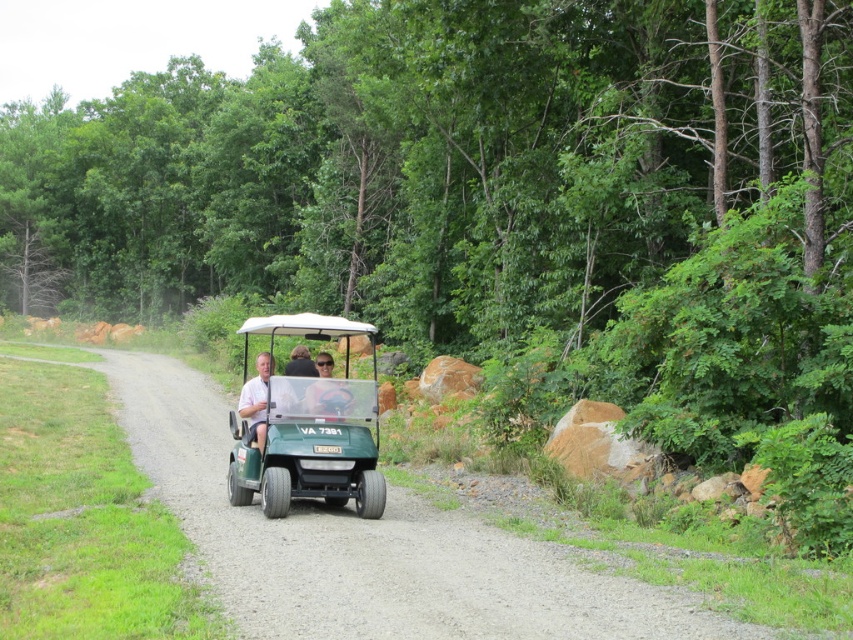
Question: Is green matte golf cart at center smaller than white matte golf cart at center?

Choices:
 (A) yes
 (B) no

Answer: (B)

Question: Can you confirm if green matte golf cart at center is wider than white matte golf cart at center?

Choices:
 (A) no
 (B) yes

Answer: (B)

Question: Which object appears farthest from the camera in this image?

Choices:
 (A) white matte golf cart at center
 (B) green matte golf cart at center

Answer: (A)

Question: Does green matte golf cart at center come in front of white matte golf cart at center?

Choices:
 (A) no
 (B) yes

Answer: (B)

Question: Which of the following is the closest to the observer?

Choices:
 (A) white matte golf cart at center
 (B) green matte golf cart at center

Answer: (B)